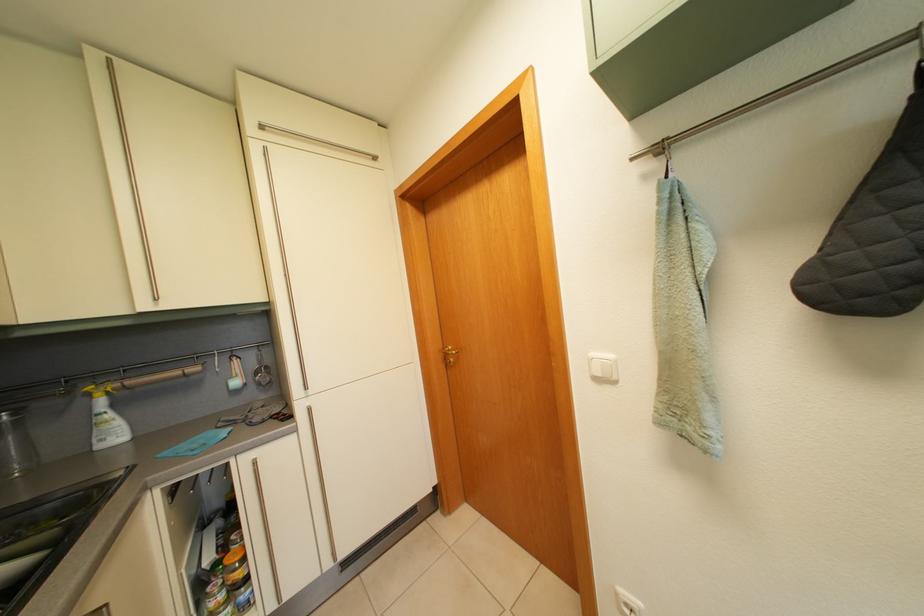
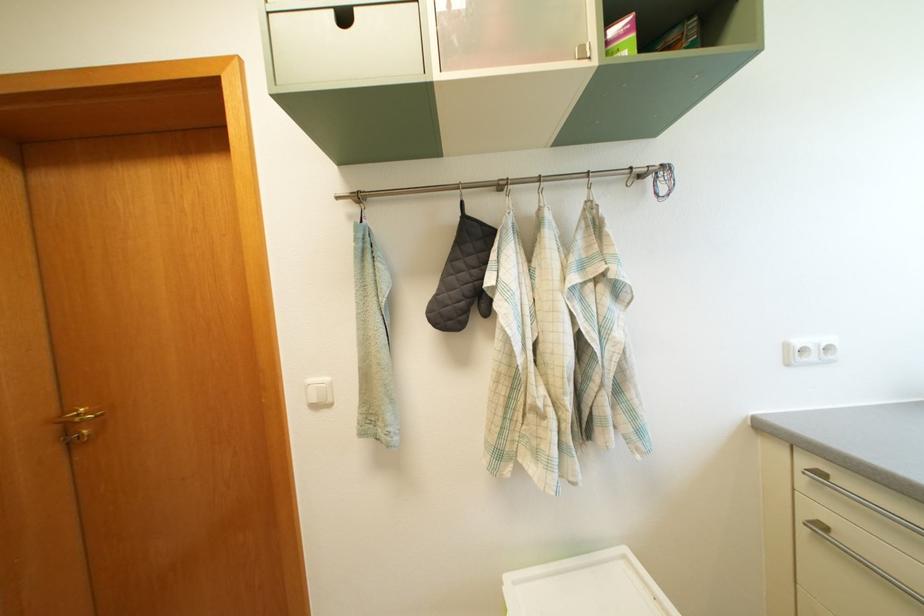
In the second image, find the point that corresponds to the point at 601,362 in the first image.

(318, 387)